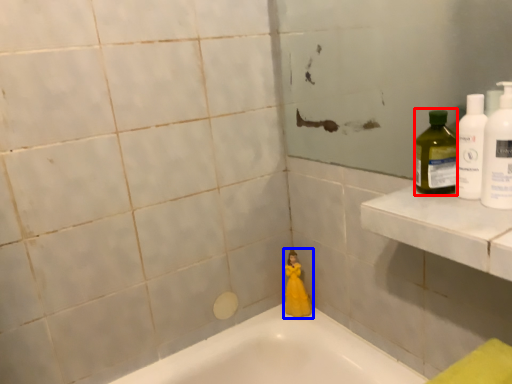
Question: Which of the following is the farthest to the observer, cleaning product (highlighted by a red box) or toy (highlighted by a blue box)?

Choices:
 (A) cleaning product
 (B) toy

Answer: (B)